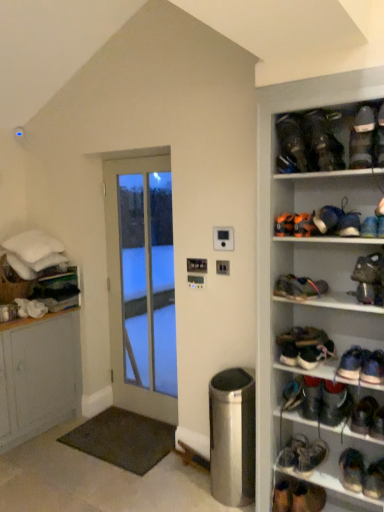
At what (x,y) coordinates should I click in order to perform the action: click on vacant space that is to the left of silver metallic trash can at center-right. Please return your answer as a coordinate pair (x, y). Looking at the image, I should click on (187, 489).